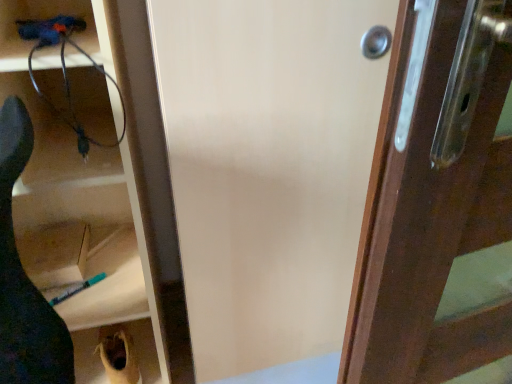
Question: From a real-world perspective, is brown fabric bag at lower left, marked as the 1th cabinetry in a bottom-to-top arrangement, positioned above or below black matte shoe at lower left?

Choices:
 (A) above
 (B) below

Answer: (B)

Question: Is point (138, 337) positioned closer to the camera than point (44, 317)?

Choices:
 (A) farther
 (B) closer

Answer: (A)

Question: Considering the real-world distances, which object is farthest from the dark brown wood at right?

Choices:
 (A) matte plastic cabinet at left, acting as the second cabinetry starting from the bottom
 (B) brown fabric bag at lower left, marked as the 1th cabinetry in a bottom-to-top arrangement
 (C) matte wood screen door at center
 (D) black matte shoe at lower left

Answer: (B)

Question: Considering the real-world distances, which object is farthest from the dark brown wood at right?

Choices:
 (A) black matte shoe at lower left
 (B) brown fabric bag at lower left, marked as the 1th cabinetry in a bottom-to-top arrangement
 (C) matte wood screen door at center
 (D) matte plastic cabinet at left, marked as the 1th cabinetry in a top-to-bottom arrangement

Answer: (B)